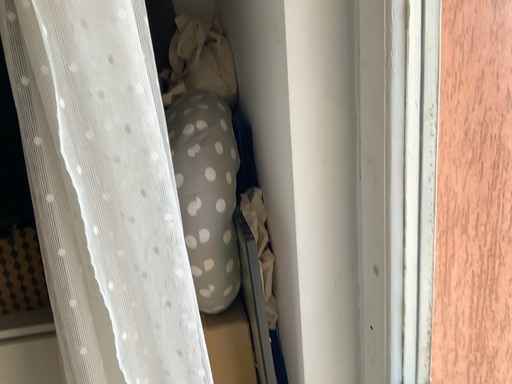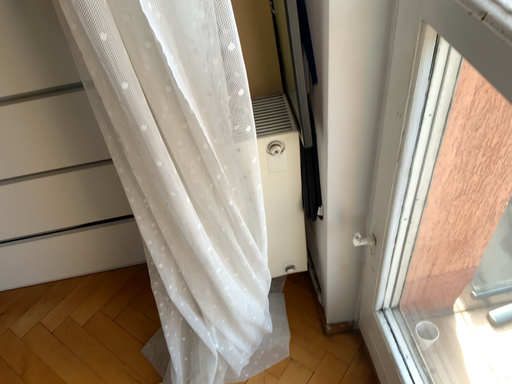
Question: How did the camera likely rotate when shooting the video?

Choices:
 (A) rotated upward
 (B) rotated downward

Answer: (B)